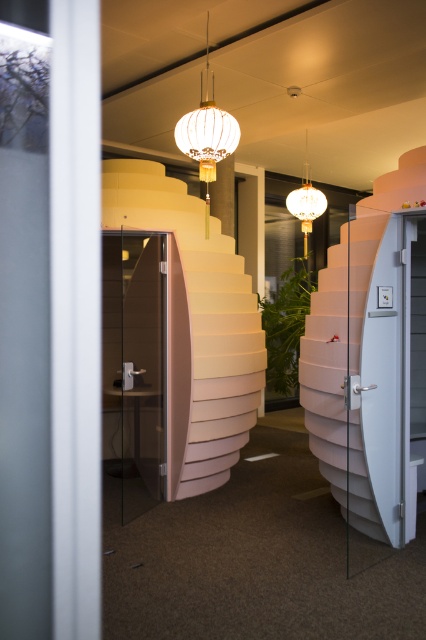
You are an interior designer planning to place a large sofa in this office space. The sofa is 2 meters wide. You see the matte pink stairs at center and the transparent glass door at left. Which object has enough space to place the sofa next to it without blocking the door?

The matte pink stairs at center has a larger width than the transparent glass door at left, so placing the sofa next to the matte pink stairs at center would provide sufficient space without blocking the door.

You are moving a 3 meter long sofa into the office space. You need to navigate past the transparent glass door at left and the matte white globe at upper center. Is there enough space between them to move the sofa through?

The transparent glass door at left and matte white globe at upper center are 2.95 meters apart. Since the sofa is 3 meters long, there is not enough space to move it through the gap between them. The sofa is slightly longer than the available space.

You are standing in the office space and want to exit through the transparent glass door at left. Based on the coordinates provided, is the point at (x=134, y=372) on the transparent glass door at left?

Yes, the point at (x=134, y=372) is on the transparent glass door at left according to the description.